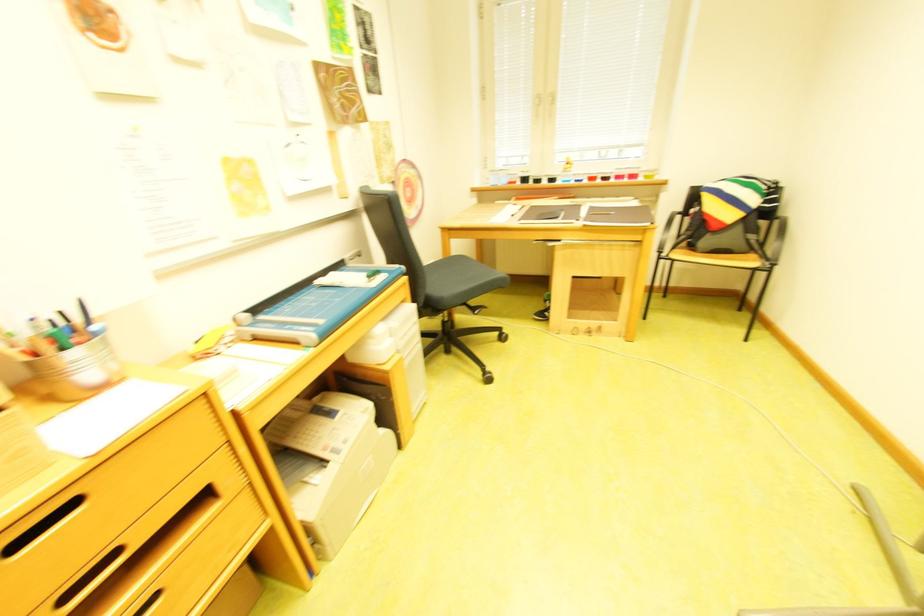
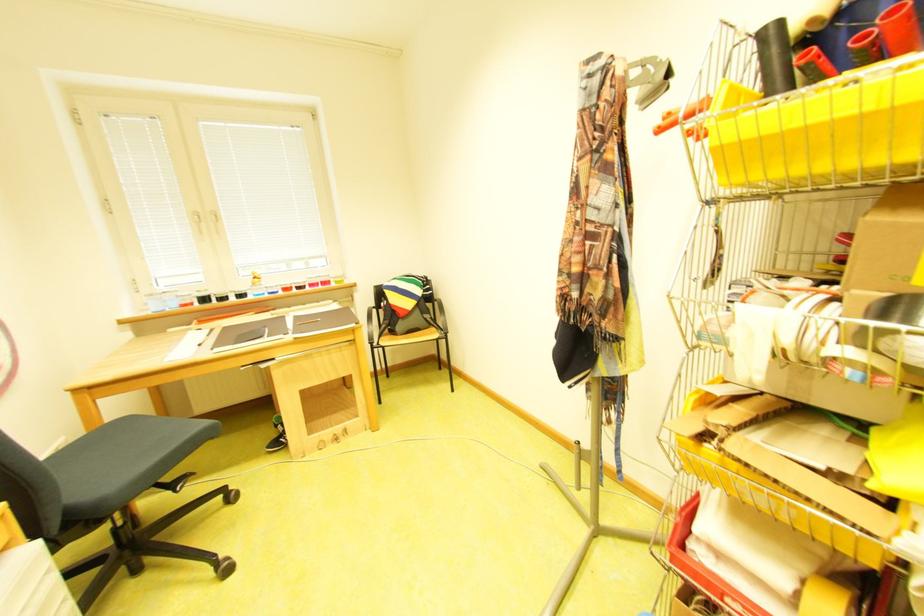
The point at (x=527, y=175) is marked in the first image. Where is the corresponding point in the second image?

(201, 296)